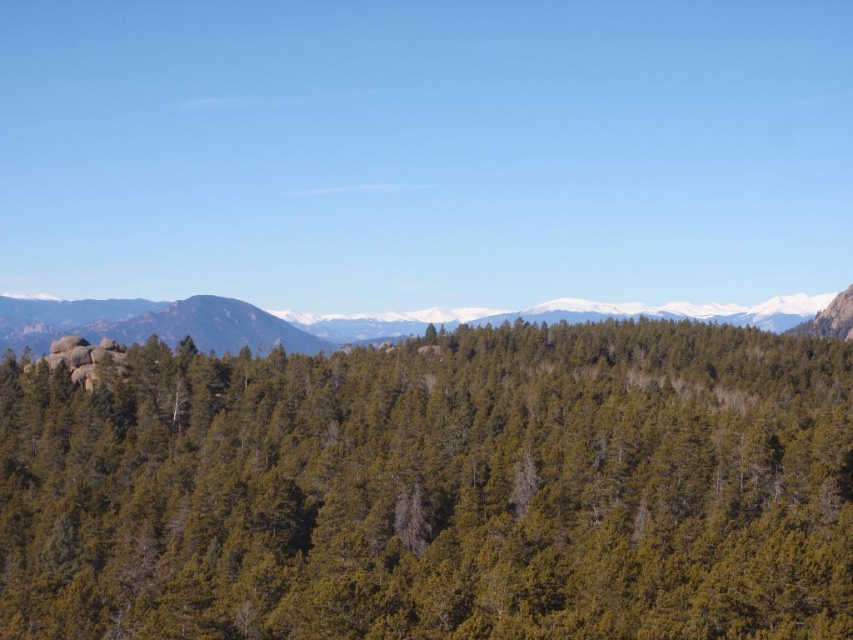
You are a hiker standing in the forest. You see a green matte tree at center and a green forested hillside at center. Which one is taller?

The green matte tree at center is much taller than the green forested hillside at center.

What object is located at the coordinates point (x=437, y=490) in the image?

The point (x=437, y=490) indicates a green matte tree at center.